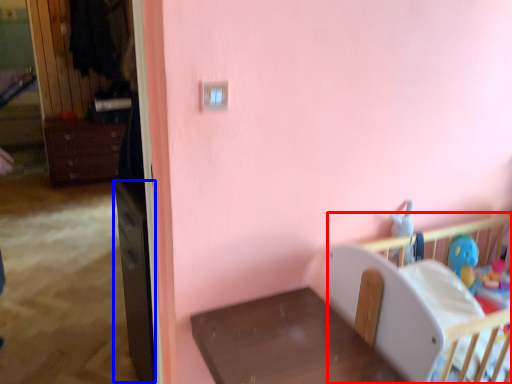
Question: Which point is further to the camera, infant bed (highlighted by a red box) or file cabinet (highlighted by a blue box)?

Choices:
 (A) infant bed
 (B) file cabinet

Answer: (B)